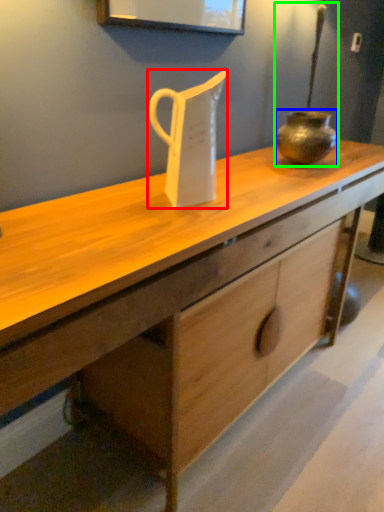
Question: Which object is positioned closest to jug (highlighted by a red box)? Select from vase (highlighted by a blue box) and candle holder (highlighted by a green box).

Choices:
 (A) vase
 (B) candle holder

Answer: (A)